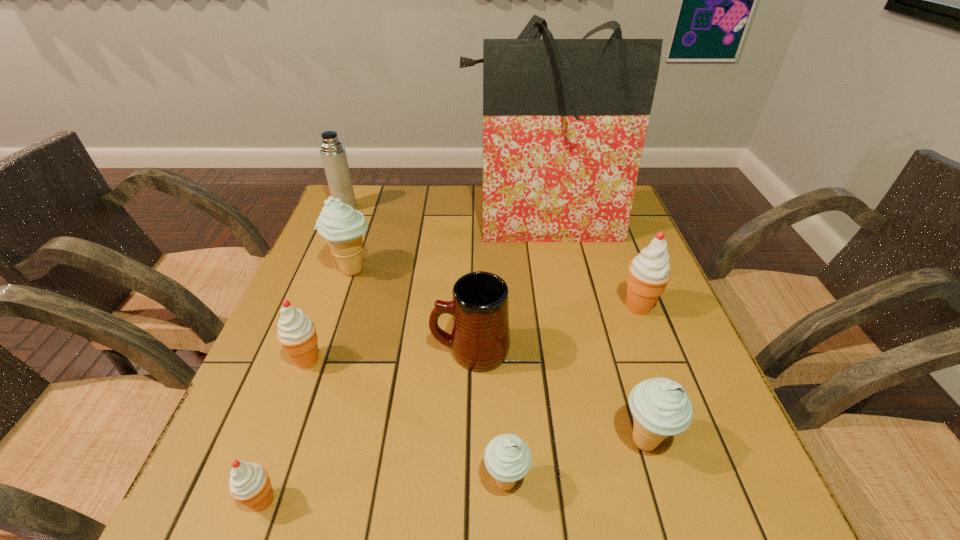
This screenshot has height=540, width=960. I want to click on the second biggest beige icecream, so click(x=661, y=408).

Locate an element on the screen. The height and width of the screenshot is (540, 960). the second beige icecream from left to right is located at coordinates (507, 457).

Identify the location of the fourth icecream from left to right. This screenshot has height=540, width=960. (507, 457).

The height and width of the screenshot is (540, 960). In order to click on the nearest red icecream in this screenshot , I will do `click(249, 483)`.

Locate an element on the screen. vacant area located 0.230m on the front side of the tallest object is located at coordinates (557, 308).

Identify the location of vacant position located 0.160m on the right of the thermos bottle. The width and height of the screenshot is (960, 540). (410, 208).

At what (x,y) coordinates should I click in order to perform the action: click on vacant space situated on the back of the leftmost beige icecream. Please return your answer as a coordinate pair (x, y). The height and width of the screenshot is (540, 960). Looking at the image, I should click on (371, 216).

Where is `vacant space located 0.330m on the left of the rightmost red icecream`? The image size is (960, 540). vacant space located 0.330m on the left of the rightmost red icecream is located at coordinates (476, 307).

Find the location of a particular element. This screenshot has width=960, height=540. vacant region located 0.300m on the side of the red mug with the handle is located at coordinates (288, 351).

Identify the location of free region located on the side of the red mug with the handle. The height and width of the screenshot is (540, 960). (288, 351).